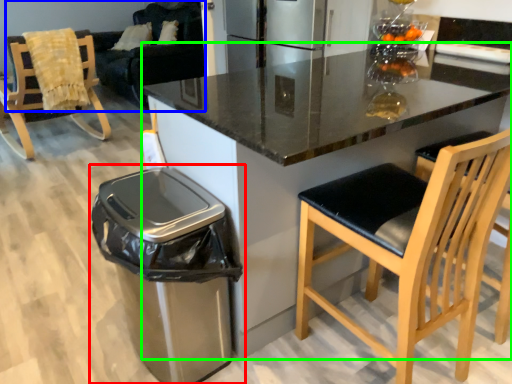
Question: Which object is positioned farthest from waste container (highlighted by a red box)? Select from couch (highlighted by a blue box) and countertop (highlighted by a green box).

Choices:
 (A) couch
 (B) countertop

Answer: (A)